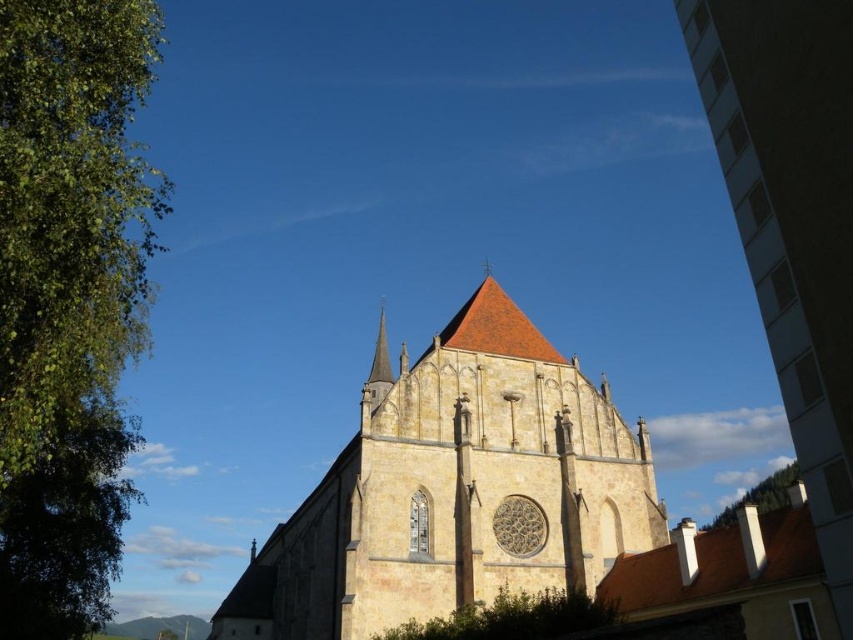
Between yellow stone church at center and white concrete building at right, which one appears on the right side from the viewer's perspective?

white concrete building at right is more to the right.

What do you see at coordinates (456, 490) in the screenshot? Image resolution: width=853 pixels, height=640 pixels. I see `yellow stone church at center` at bounding box center [456, 490].

Is point (538, 451) positioned after point (840, 611)?

Yes, it is.

Locate an element on the screen. The width and height of the screenshot is (853, 640). yellow stone church at center is located at coordinates (456, 490).

Is white concrete building at right taller than green leafy tree at upper left?

Yes.

Between point (848, 26) and point (776, 483), which one is positioned behind?

The point (776, 483) is more distant.

Identify the location of white concrete building at right. This screenshot has width=853, height=640. (792, 221).

Is point (786, 28) in front of point (505, 620)?

Yes, it is in front of point (505, 620).

Can you confirm if white concrete building at right is taller than green leafy tree at lower center?

Yes, white concrete building at right is taller than green leafy tree at lower center.

Identify the location of white concrete building at right. (792, 221).

The image size is (853, 640). I want to click on white concrete building at right, so click(792, 221).